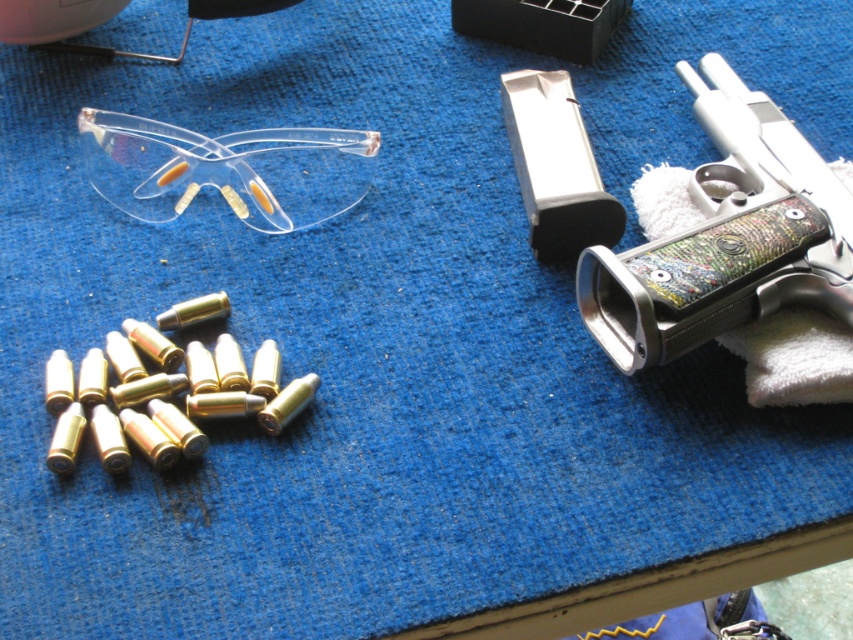
Question: Is polished silver revolver at right positioned before transparent plastic goggles at upper left?

Choices:
 (A) yes
 (B) no

Answer: (A)

Question: Which object is closer to the camera taking this photo?

Choices:
 (A) transparent plastic goggles at upper left
 (B) polished silver revolver at right

Answer: (B)

Question: Which of the following is the farthest from the observer?

Choices:
 (A) (807, 268)
 (B) (264, 196)

Answer: (B)

Question: Can you confirm if polished silver revolver at right is smaller than transparent plastic goggles at upper left?

Choices:
 (A) yes
 (B) no

Answer: (B)

Question: Does polished silver revolver at right have a smaller size compared to transparent plastic goggles at upper left?

Choices:
 (A) no
 (B) yes

Answer: (A)